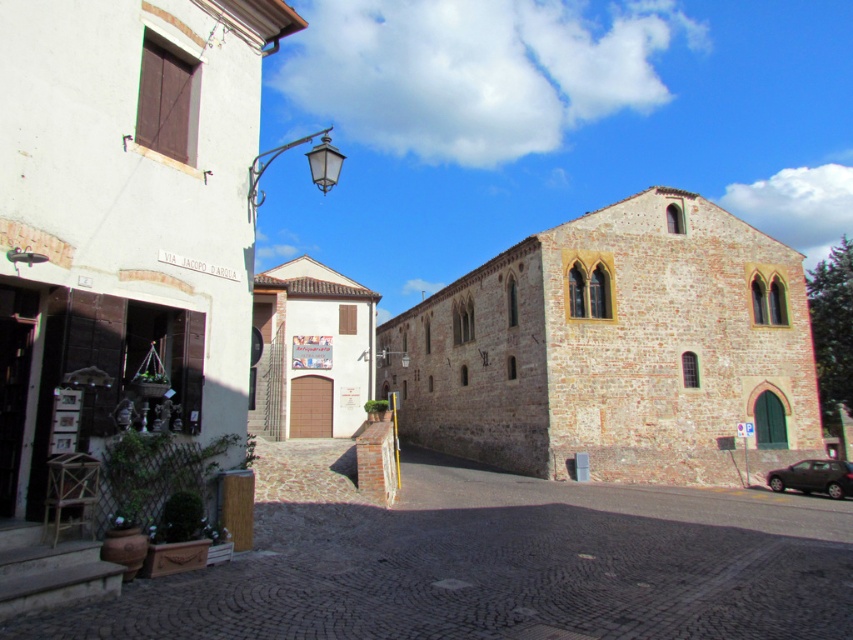
You are a tourist standing at the entrance of the street and want to visit both the white stone church at left and the white matte church at center. If you start from the entrance, which church should you walk towards first to minimize the total distance you have to walk?

You should walk towards the white matte church at center first because it is closer to the entrance than the white stone church at left, so visiting it first would minimize the total distance walked.

From the picture: You are a tourist in the historic town and want to take a photo of both the white stone church at left and the white matte church at center. Since you have a camera with a fixed focal length, you need to know which church is narrower so you can position yourself appropriately. Which church is narrower?

The white stone church at left is narrower than the white matte church at center, so you should position yourself closer to the white stone church at left to capture both in your shot.

You are standing on the street and want to take a photo that includes both the white building with the sign and the small garden in front of it. Which of the two points, point (x=9, y=552) or point (x=827, y=481), should you focus on to ensure both the building and the garden are in clear view?

You should focus on point (x=9, y=552) because it is closer to the camera than point (x=827, y=481), allowing both the white building with the sign and the small garden in front of it to be in clear view.